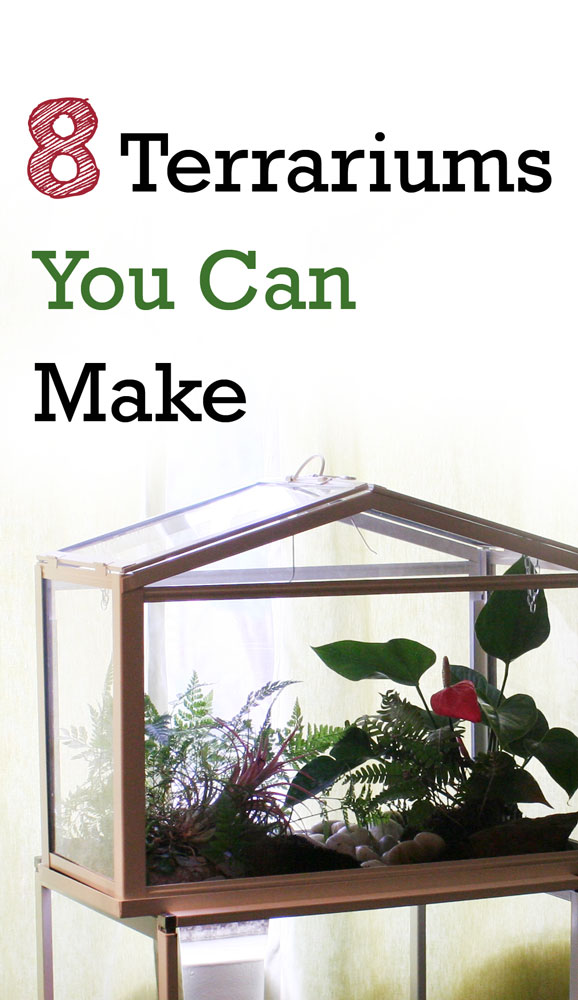
Where is `plant`? plant is located at coordinates (181, 774), (484, 775).